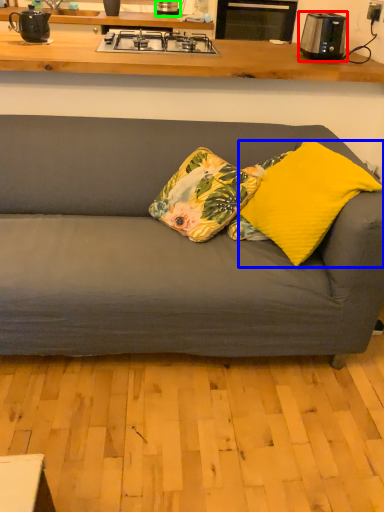
Question: Based on their relative distances, which object is farther from kitchen appliance (highlighted by a red box)? Choose from pillow (highlighted by a blue box) and kitchen appliance (highlighted by a green box).

Choices:
 (A) pillow
 (B) kitchen appliance

Answer: (B)